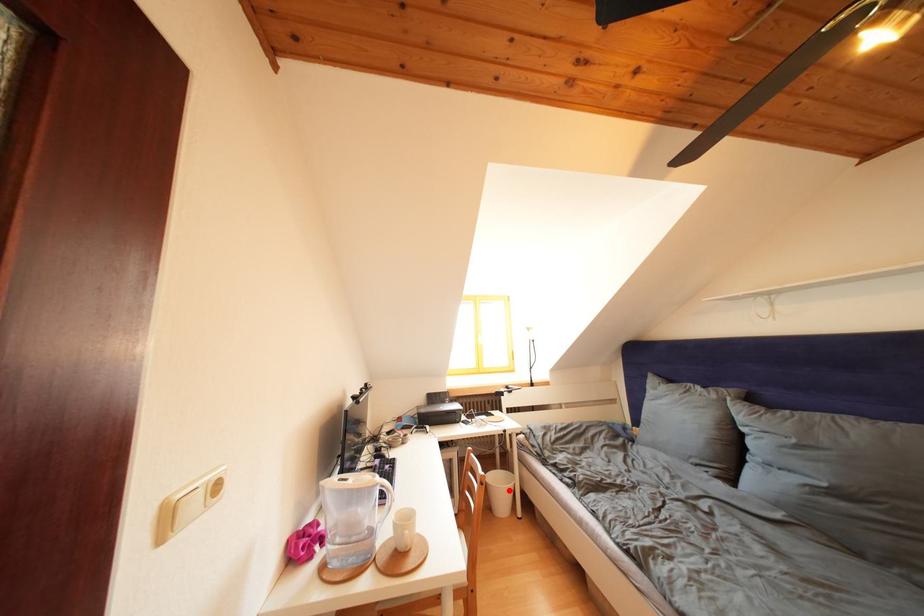
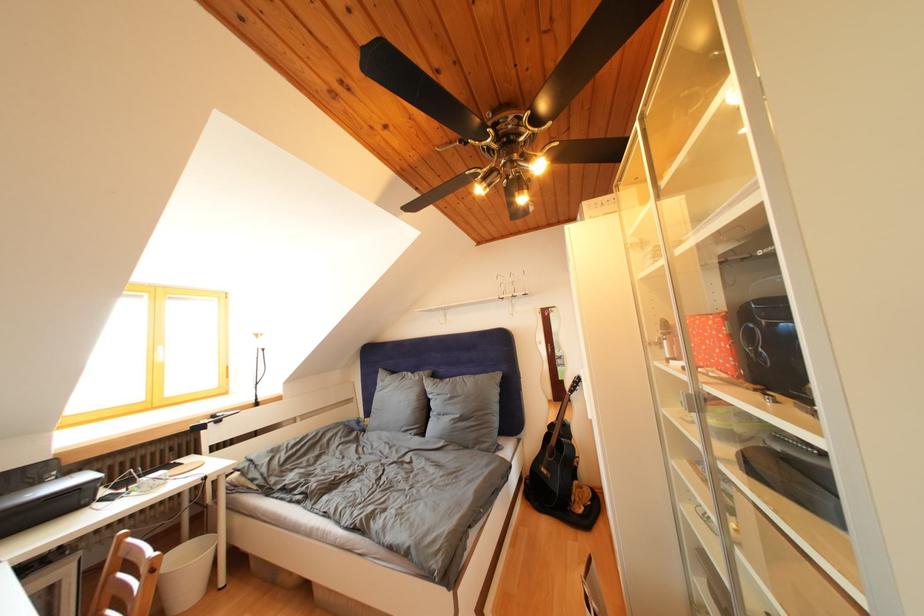
Question: I am providing you with two images of the same scene from different viewpoints. Image1 has a red point marked. In image2, the corresponding 3D location appears at what relative position? Reply with the corresponding letter.

Choices:
 (A) Closer
 (B) Farther

Answer: (A)